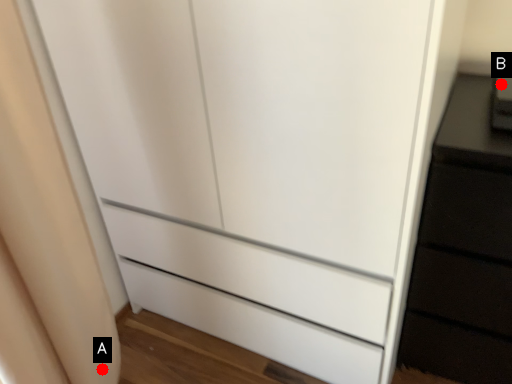
Question: Two points are circled on the image, labeled by A and B beside each circle. Which of the following is the farthest from the observer?

Choices:
 (A) A is further
 (B) B is further

Answer: (A)